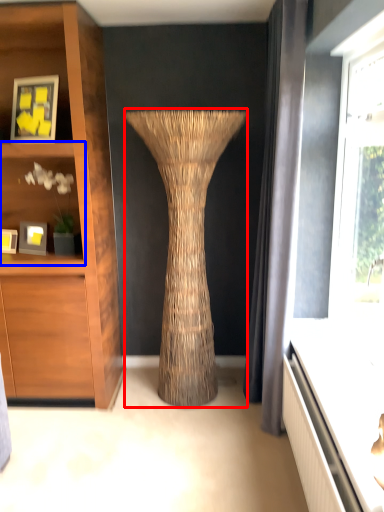
Question: Which object appears farthest to the camera in this image, vase (highlighted by a red box) or shelf (highlighted by a blue box)?

Choices:
 (A) vase
 (B) shelf

Answer: (B)